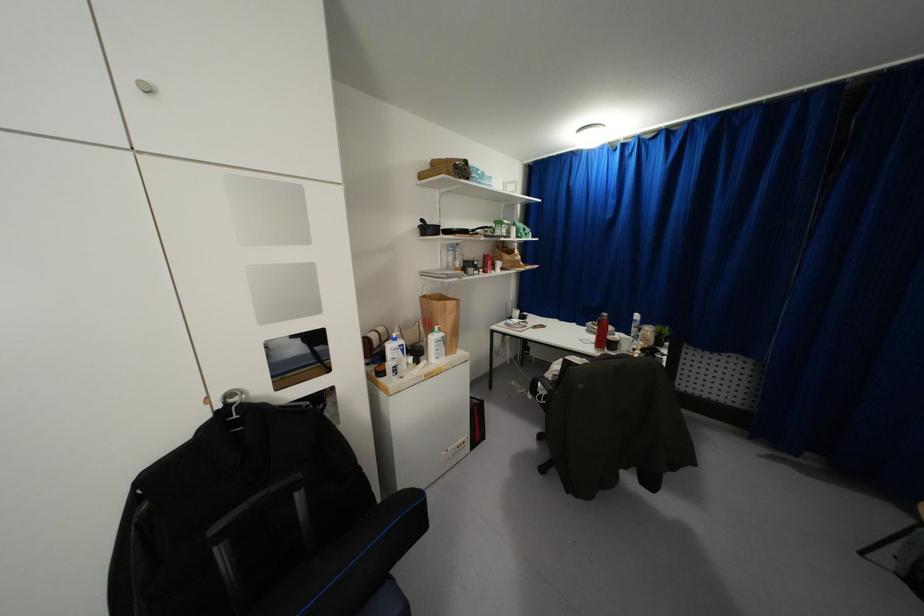
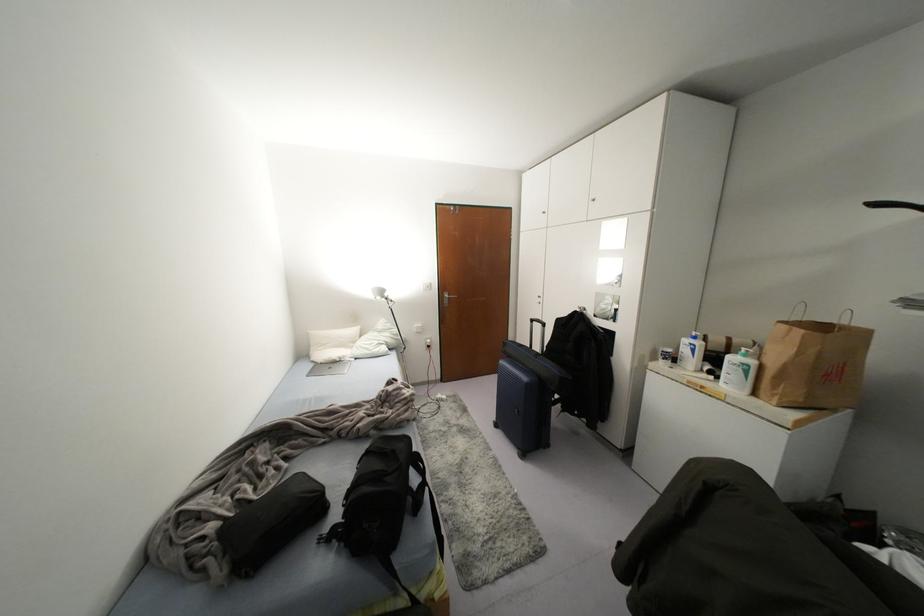
Where in the second image is the point corresponding to point 442,333 from the first image?

(751, 362)